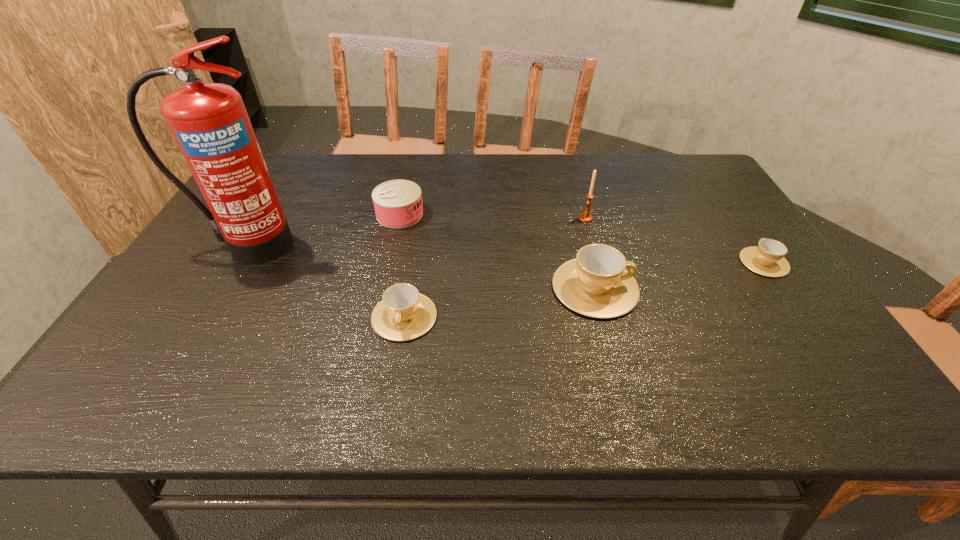
Image resolution: width=960 pixels, height=540 pixels. In order to click on the second shortest cup in this screenshot , I will do `click(403, 314)`.

Where is `the fourth shortest object`? This screenshot has width=960, height=540. the fourth shortest object is located at coordinates (596, 284).

Image resolution: width=960 pixels, height=540 pixels. In order to click on the tallest cup in this screenshot , I will do `click(596, 284)`.

The image size is (960, 540). Identify the location of the shortest object. (767, 259).

I want to click on the rightmost object, so click(x=767, y=259).

Locate an element on the screen. fire extinguisher is located at coordinates (209, 122).

Locate an element on the screen. The image size is (960, 540). the leftmost object is located at coordinates (209, 122).

This screenshot has height=540, width=960. I want to click on can, so click(398, 203).

Where is `candle_holder`? Image resolution: width=960 pixels, height=540 pixels. candle_holder is located at coordinates (585, 217).

Find the location of `vacant space located with the handle on the side of the second cup from left to right`. vacant space located with the handle on the side of the second cup from left to right is located at coordinates pyautogui.click(x=719, y=288).